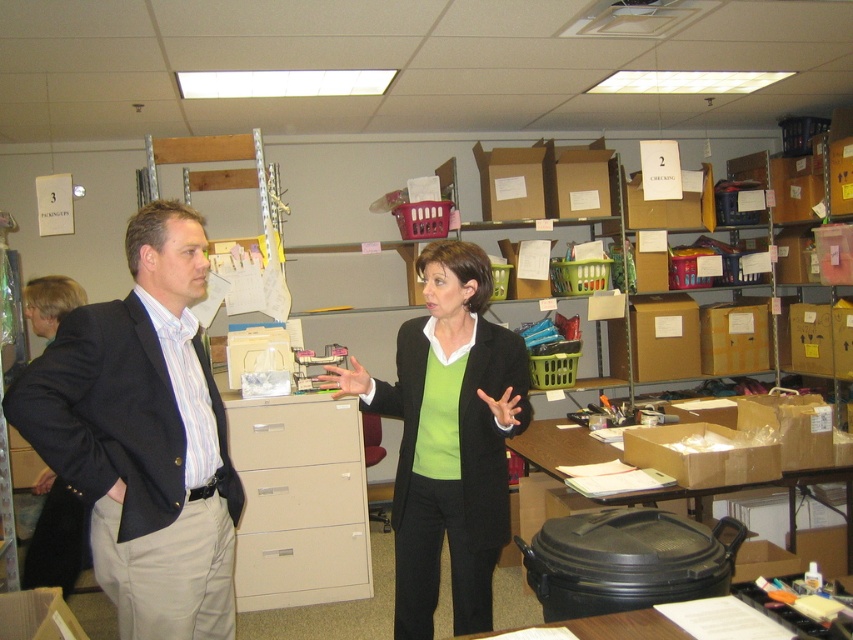
Question: Does beige/file cabinet at center appear under brown cardboard box at center?

Choices:
 (A) yes
 (B) no

Answer: (A)

Question: Which of these objects is positioned farthest from the dark blue suit at center?

Choices:
 (A) green matte blazer at center
 (B) beige plastic file cabinet at center

Answer: (B)

Question: Which point is closer to the camera taking this photo?

Choices:
 (A) (328, 412)
 (B) (231, 563)
 (C) (643, 321)

Answer: (B)

Question: Is dark blue suit at center bigger than beige plastic file cabinet at center?

Choices:
 (A) yes
 (B) no

Answer: (A)

Question: Is green matte blazer at center further to camera compared to beige/file cabinet at center?

Choices:
 (A) no
 (B) yes

Answer: (A)

Question: Which object is positioned farthest from the brown cardboard box at center?

Choices:
 (A) matte white drawer at center
 (B) beige matte drawer at center

Answer: (B)